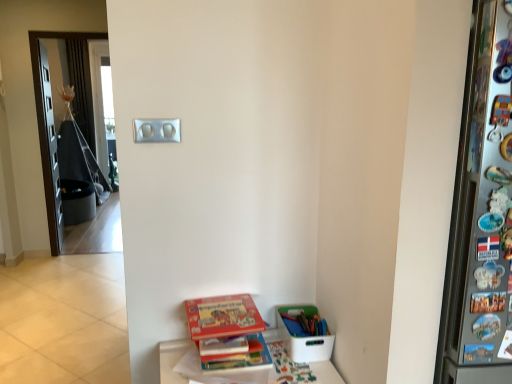
Identify the location of vacant area on top of hardcover book at lower center, which ranks as the 1th book in top-to-bottom order (from a real-world perspective). The image size is (512, 384). (224, 307).